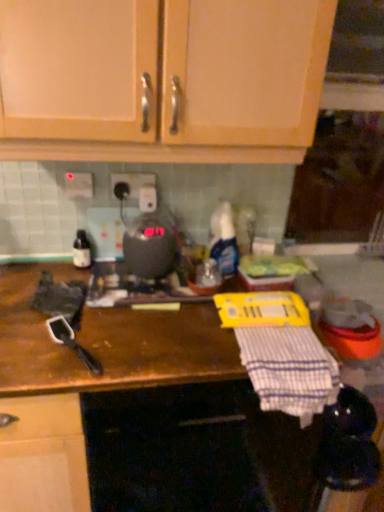
This screenshot has height=512, width=384. Identify the location of free space above brown wooden countertop at center (from a real-world perspective). (112, 315).